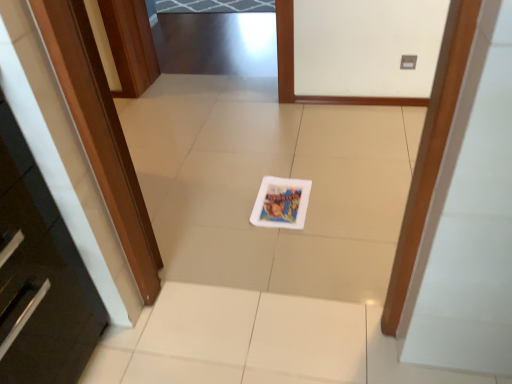
Question: Is wooden door at left to the left of white glossy postcard at center from the viewer's perspective?

Choices:
 (A) yes
 (B) no

Answer: (A)

Question: From a real-world perspective, does wooden door at left stand above white glossy postcard at center?

Choices:
 (A) yes
 (B) no

Answer: (A)

Question: Is wooden door at left directly adjacent to white glossy postcard at center?

Choices:
 (A) no
 (B) yes

Answer: (A)

Question: Considering the relative sizes of wooden door at left and white glossy postcard at center in the image provided, is wooden door at left shorter than white glossy postcard at center?

Choices:
 (A) yes
 (B) no

Answer: (B)

Question: Does wooden door at left have a smaller size compared to white glossy postcard at center?

Choices:
 (A) yes
 (B) no

Answer: (B)

Question: Can you confirm if wooden door at left is positioned to the right of white glossy postcard at center?

Choices:
 (A) yes
 (B) no

Answer: (B)

Question: From the image's perspective, would you say white glossy postcard at center is shown under wooden door at left?

Choices:
 (A) no
 (B) yes

Answer: (B)

Question: Is white glossy postcard at center positioned beyond the bounds of wooden door at left?

Choices:
 (A) yes
 (B) no

Answer: (A)

Question: Is white glossy postcard at center positioned before wooden door at left?

Choices:
 (A) no
 (B) yes

Answer: (A)

Question: Is white glossy postcard at center at the left side of wooden door at left?

Choices:
 (A) yes
 (B) no

Answer: (B)

Question: From a real-world perspective, does white glossy postcard at center sit lower than wooden door at left?

Choices:
 (A) yes
 (B) no

Answer: (A)

Question: Can wooden door at left be found inside white glossy postcard at center?

Choices:
 (A) yes
 (B) no

Answer: (B)

Question: Is point (137, 200) closer or farther from the camera than point (278, 210)?

Choices:
 (A) farther
 (B) closer

Answer: (B)